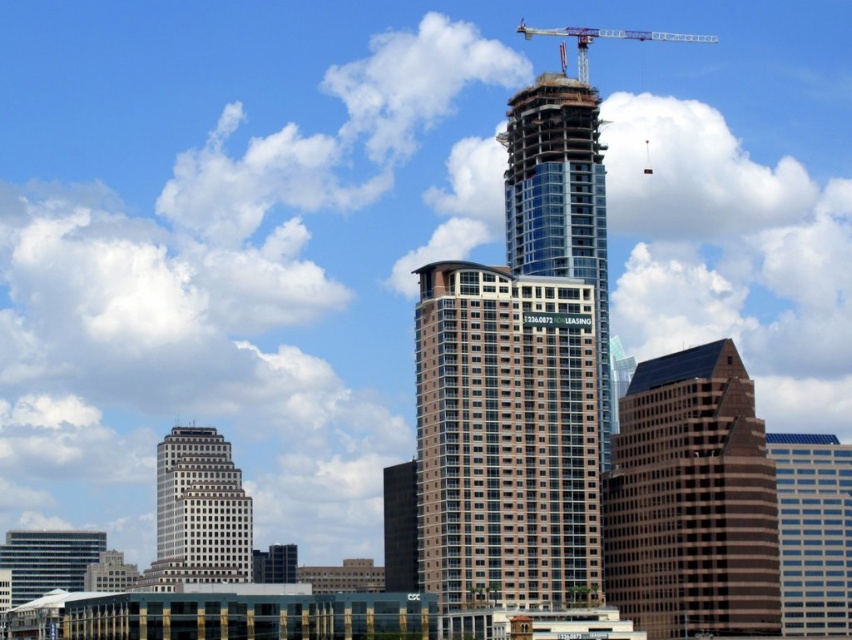
Is clear glass skyscraper at center above white glass building at lower left?

Indeed, clear glass skyscraper at center is positioned over white glass building at lower left.

Can you confirm if clear glass skyscraper at center is bigger than white glass building at lower left?

Yes, clear glass skyscraper at center is bigger than white glass building at lower left.

The width and height of the screenshot is (852, 640). Describe the element at coordinates (560, 202) in the screenshot. I see `clear glass skyscraper at center` at that location.

Find the location of a particular element. This screenshot has height=640, width=852. clear glass skyscraper at center is located at coordinates (560, 202).

Can you confirm if brown glassy building at center-right is positioned to the right of blue glass skyscraper at center?

In fact, brown glassy building at center-right is to the left of blue glass skyscraper at center.

Does brown glassy building at center-right come in front of blue glass skyscraper at center?

Yes, it is in front of blue glass skyscraper at center.

Is point (640, 433) less distant than point (841, 465)?

Yes, point (640, 433) is closer to viewer.

Find the location of `brown glassy building at center-right`. brown glassy building at center-right is located at coordinates (691, 500).

Where is `brown glassy building at center`? Image resolution: width=852 pixels, height=640 pixels. brown glassy building at center is located at coordinates (505, 436).

What do you see at coordinates (505, 436) in the screenshot?
I see `brown glassy building at center` at bounding box center [505, 436].

Is point (499, 296) farther from viewer compared to point (784, 451)?

No, (499, 296) is closer to viewer.

Identify the location of brown glassy building at center. (505, 436).